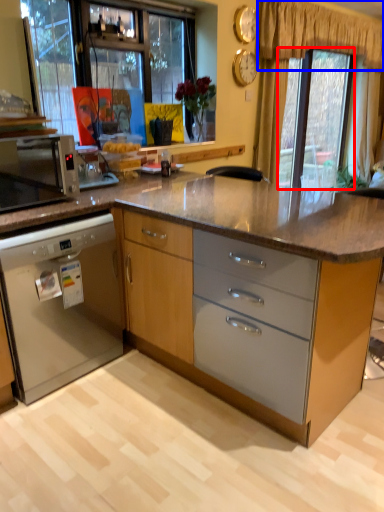
Question: Which point is further to the camera, window screen (highlighted by a red box) or curtain (highlighted by a blue box)?

Choices:
 (A) window screen
 (B) curtain

Answer: (A)